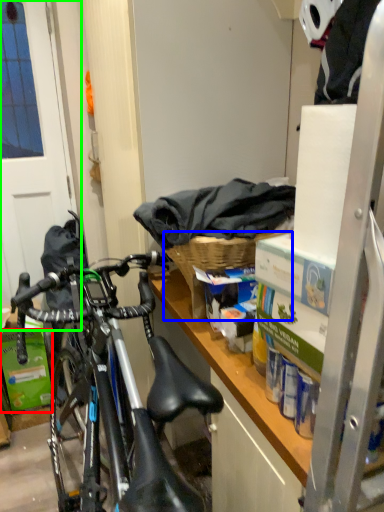
Question: Which object is the farthest from box (highlighted by a red box)? Choose among these: picnic basket (highlighted by a blue box) or screen door (highlighted by a green box).

Choices:
 (A) picnic basket
 (B) screen door

Answer: (A)